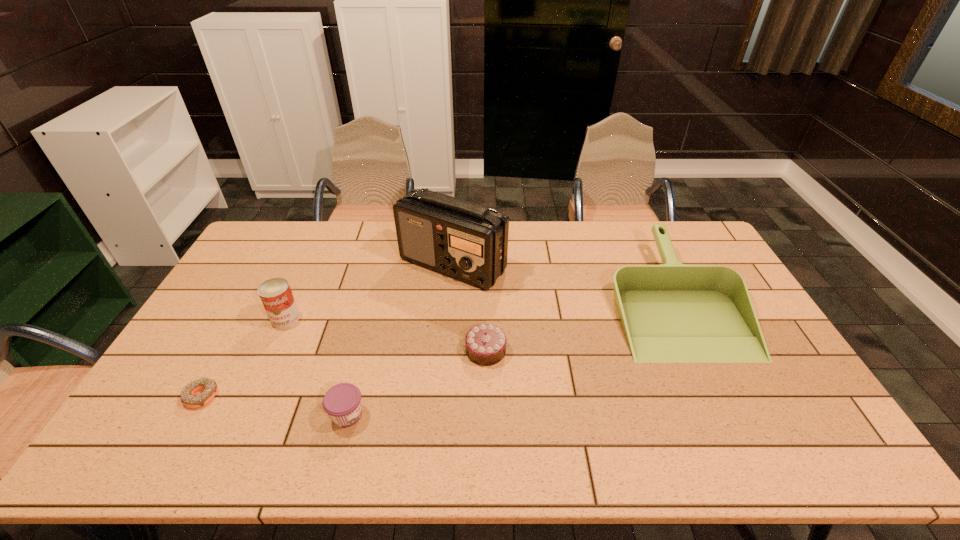
In the image, there is a desktop. Find the location of `blank space at the near edge`. blank space at the near edge is located at coordinates (208, 440).

You are a GUI agent. You are given a task and a screenshot of the screen. Output one action in this format:
    pyautogui.click(x=<x>, y=<y>)
    Task: Click on the free region at the left edge of the desktop
    
    Given the screenshot: What is the action you would take?
    pyautogui.click(x=244, y=318)

This screenshot has width=960, height=540. Identify the location of vacant space at the right edge of the desktop. (776, 370).

At what (x,y) coordinates should I click in order to perform the action: click on vacant region at the far right corner of the desktop. Please return your answer as a coordinate pair (x, y). Looking at the image, I should click on (702, 251).

Locate an element on the screen. The width and height of the screenshot is (960, 540). free spot between the jam and the chocolate cake is located at coordinates (417, 382).

Where is `unoccupied area between the third object from left to right and the can`? unoccupied area between the third object from left to right and the can is located at coordinates coord(317,366).

Locate an element on the screen. The height and width of the screenshot is (540, 960). free spot between the leftmost object and the chocolate cake is located at coordinates (344, 373).

You are a GUI agent. You are given a task and a screenshot of the screen. Output one action in this format:
    pyautogui.click(x=<x>, y=<y>)
    Task: Click on the empty space between the rightmost object and the radio receiver
    This screenshot has height=540, width=960.
    Given the screenshot: What is the action you would take?
    pyautogui.click(x=563, y=282)

Identify the location of vacant region between the third object from left to right and the shortest object. Image resolution: width=960 pixels, height=540 pixels. (275, 405).

Where is `free spot between the dustpan and the chocolate cake`? This screenshot has height=540, width=960. free spot between the dustpan and the chocolate cake is located at coordinates (580, 325).